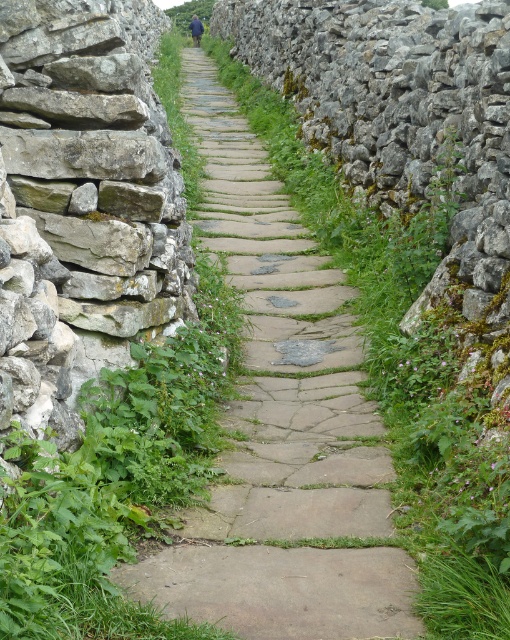
Question: Which point is farther to the camera?

Choices:
 (A) green leafy grass at center
 (B) rough stone wall at left

Answer: (B)

Question: Can you confirm if rough stone wall at left is positioned to the left of green leafy grass at center?

Choices:
 (A) yes
 (B) no

Answer: (A)

Question: Which point appears closest to the camera in this image?

Choices:
 (A) 480,420
 (B) 36,68

Answer: (A)

Question: Can you confirm if rough stone wall at left is wider than green leafy grass at center?

Choices:
 (A) yes
 (B) no

Answer: (B)

Question: Is rough stone wall at left positioned at the back of green leafy grass at center?

Choices:
 (A) yes
 (B) no

Answer: (A)

Question: Which point is farther to the camera?

Choices:
 (A) coord(18,252)
 (B) coord(457,497)

Answer: (B)